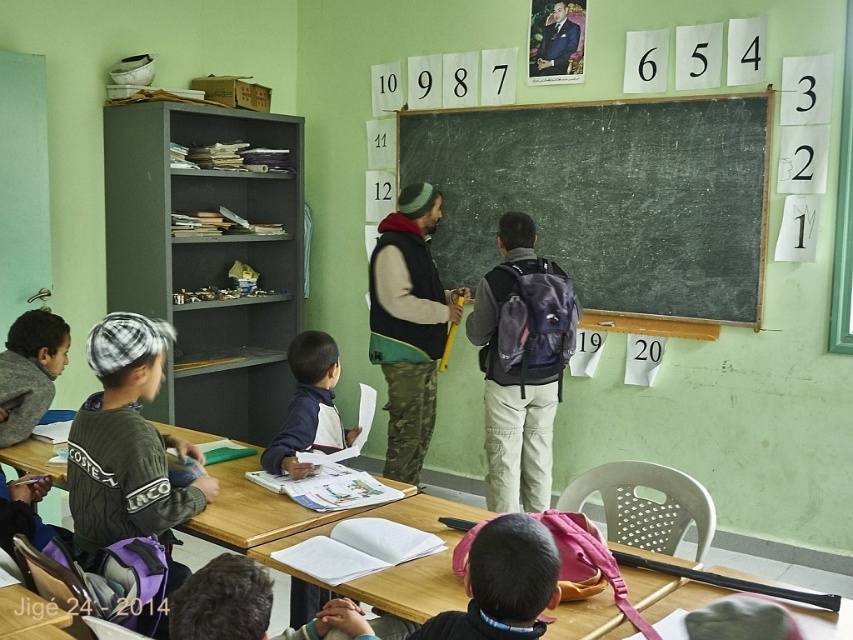
You are a teacher observing the classroom. You see a knitted green sweater at left and a camo fabric vest at center. Which clothing item is closer to you?

The knitted green sweater at left is closer to you because it is in front of the camo fabric vest at center.

You are a student who just entered the classroom and need to find your desk. You see the wooden desk at center and the black matte backpack at center. Which object is located to the left of the other?

The wooden desk at center is positioned on the left side of black matte backpack at center.

You are a student in the classroom and want to place your backpack on the wooden desk at center and the wooden table at lower left. Which surface will your backpack be closer to you after placing it?

The wooden desk at center will be closer to you because it is positioned closer to the viewer than the wooden table at lower left.